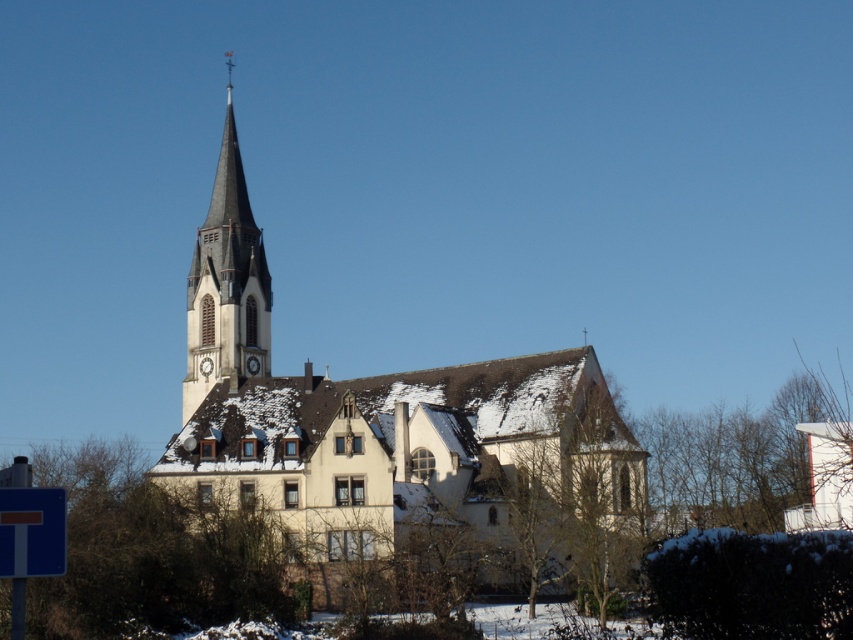
Which is more to the right, white stone church at center or smooth gray steeple at center-left?

From the viewer's perspective, white stone church at center appears more on the right side.

Is point (264, 388) farther from viewer compared to point (206, 365)?

No, it is not.

Identify the location of white stone church at center. This screenshot has height=640, width=853. (395, 433).

Image resolution: width=853 pixels, height=640 pixels. What are the coordinates of `white stone church at center` in the screenshot? It's located at (395, 433).

Who is more distant from viewer, (206,321) or (6,492)?

The point (206,321) is behind.

What do you see at coordinates (225, 282) in the screenshot?
I see `smooth gray steeple at center-left` at bounding box center [225, 282].

Find the location of a particular element. The width and height of the screenshot is (853, 640). smooth gray steeple at center-left is located at coordinates tap(225, 282).

Is white stone church at center positioned in front of blue plastic sign at lower left?

No, it is not.

Between white stone church at center and blue plastic sign at lower left, which one appears on the right side from the viewer's perspective?

From the viewer's perspective, blue plastic sign at lower left appears more on the right side.

Who is more forward, (229, 172) or (55, 509)?

Positioned in front is point (55, 509).

You are a GUI agent. You are given a task and a screenshot of the screen. Output one action in this format:
    pyautogui.click(x=<x>, y=<y>)
    Task: Click on the white stone church at center
    The height and width of the screenshot is (640, 853).
    Given the screenshot: What is the action you would take?
    pyautogui.click(x=395, y=433)